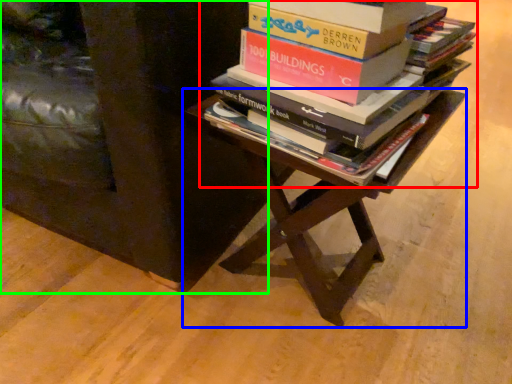
Question: Considering the real-world distances, which object is closest to book (highlighted by a red box)? table (highlighted by a blue box) or furniture (highlighted by a green box).

Choices:
 (A) table
 (B) furniture

Answer: (A)